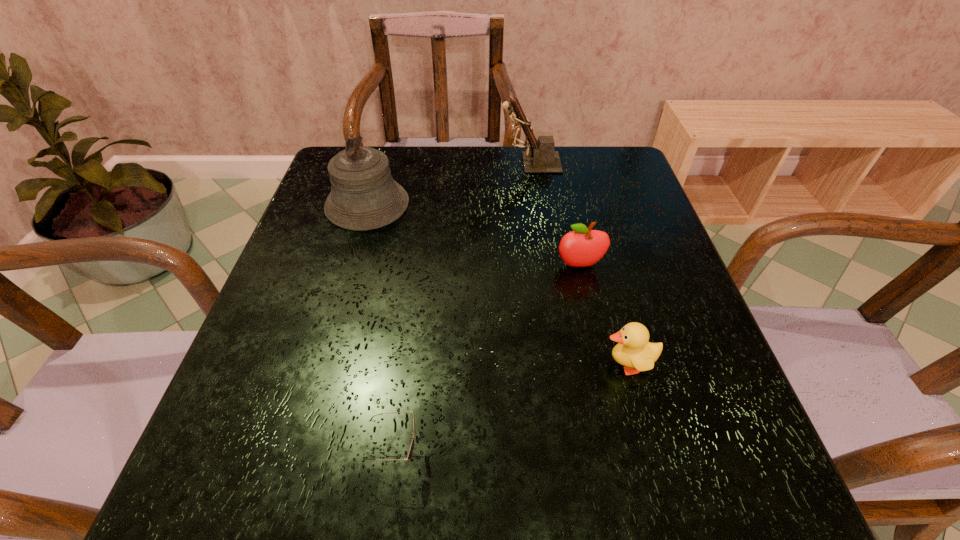
The width and height of the screenshot is (960, 540). Identify the location of vacant space that satisfies the following two spatial constraints: 1. on the front-facing side of the farthest object; 2. on the left side of the third nearest object. (545, 265).